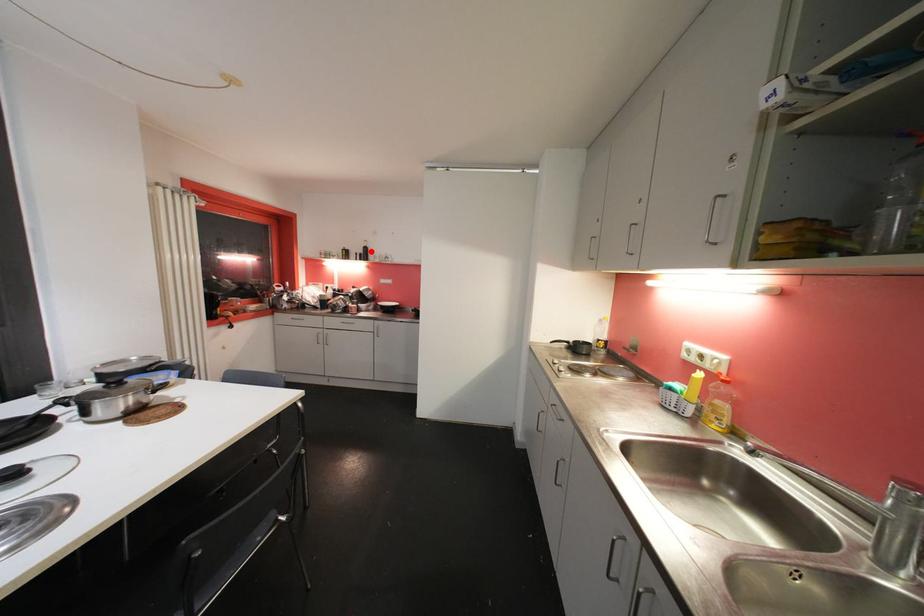
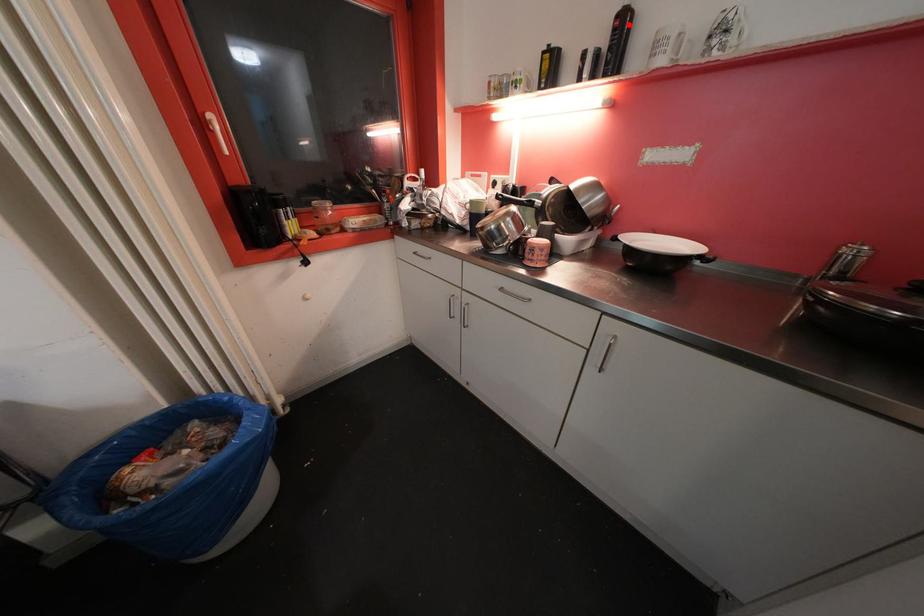
I am providing you with two images of the same scene from different viewpoints. A red point is marked on the first image and another point is marked on the second image. Do the highlighted points in image1 and image2 indicate the same real-world spot?

Yes